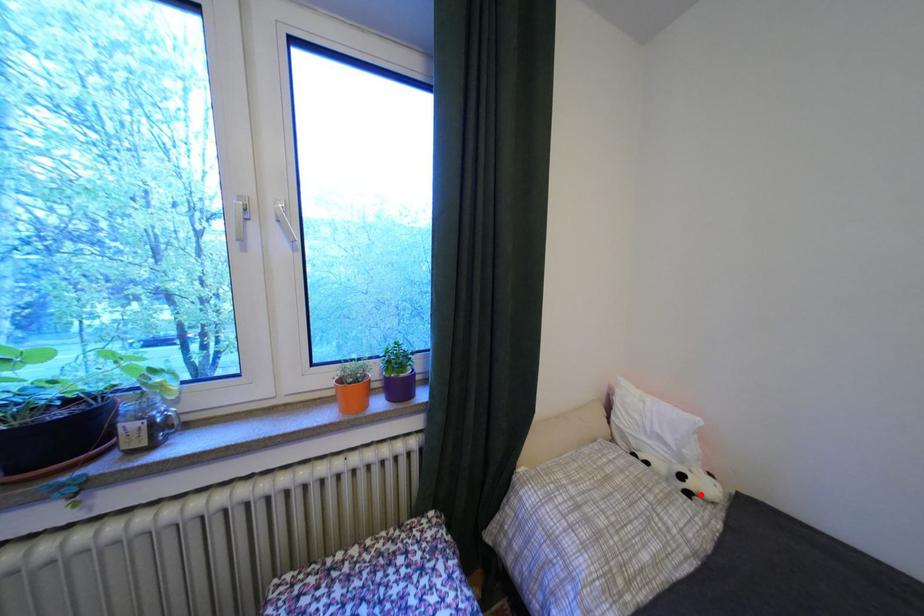
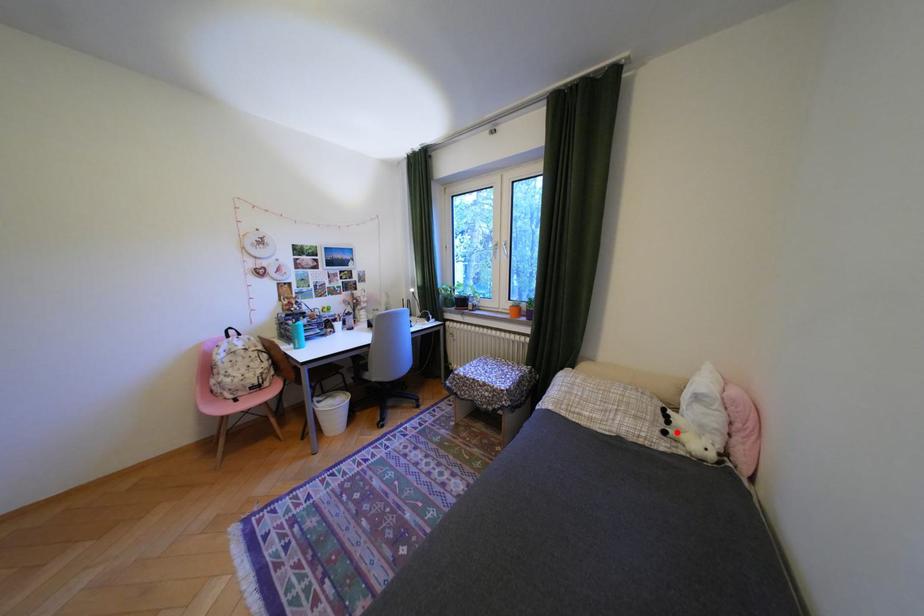
I am providing you with two images of the same scene from different viewpoints. A red point is marked on the first image and another point is marked on the second image. Is the red point in image1 aligned with the point shown in image2?

Yes